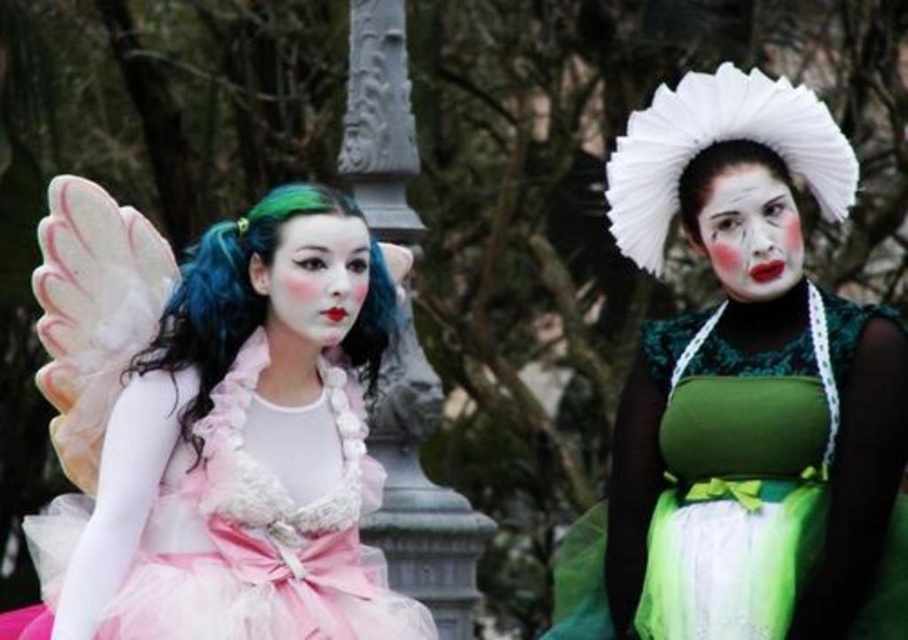
You are a photographer taking a picture of the two people in the scene. You want to ensure that the matte pink tulle dress at left and the matte white face at center are both clearly visible in the frame. Based on their positions, which one should you focus on first to ensure proper focus?

The matte pink tulle dress at left is located below the matte white face at center. To ensure both are in focus, you should focus on the matte white face at center first since it is closer to the camera, allowing the matte pink tulle dress at left to fall within the depth of field.

You are a photographer setting up a shoot for a fashion magazine. You need to ensure that the matte pink tulle dress at left and the green silky wig at left are both visible in the frame. Given their sizes, which object should you prioritize positioning closer to the camera to ensure it doesn

The matte pink tulle dress at left is wider than the green silky wig at left. To ensure both are visible, prioritize positioning the wider matte pink tulle dress at left closer to the camera since its larger size might require more space in the frame.

You are a photographer setting up a camera to capture both the matte pink tulle dress at left and the matte white face at center in the same frame. Based on their sizes, which object should you focus on first to ensure both are in the frame?

The matte pink tulle dress at left is wider than the matte white face at center, so you should focus on the matte pink tulle dress at left first to ensure both fit in the frame.